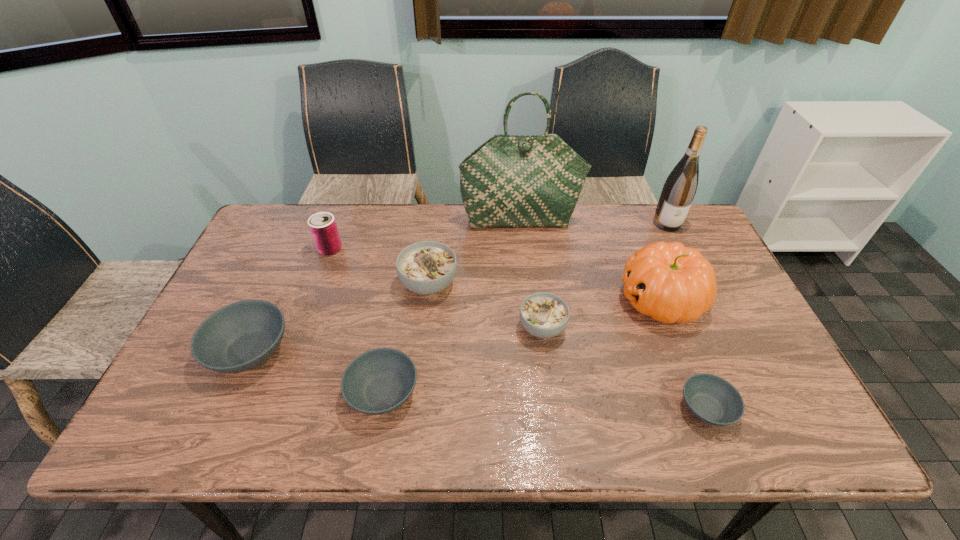
At what (x,y) coordinates should I click in order to perform the action: click on wine bottle that is at the far edge. Please return your answer as a coordinate pair (x, y). The image size is (960, 540). Looking at the image, I should click on (678, 192).

Identify the location of can that is at the far edge. The height and width of the screenshot is (540, 960). (323, 228).

The width and height of the screenshot is (960, 540). I want to click on object that is at the left edge, so click(x=241, y=336).

Where is `wine bottle positioned at the right edge`? The width and height of the screenshot is (960, 540). wine bottle positioned at the right edge is located at coordinates (678, 192).

Where is `pumpkin at the right edge`? Image resolution: width=960 pixels, height=540 pixels. pumpkin at the right edge is located at coordinates (671, 283).

In order to click on soup bowl situated at the right edge in this screenshot , I will do `click(712, 399)`.

The image size is (960, 540). In order to click on object located at the far right corner in this screenshot , I will do `click(678, 192)`.

Where is `object at the near right corner`? Image resolution: width=960 pixels, height=540 pixels. object at the near right corner is located at coordinates (712, 399).

This screenshot has height=540, width=960. I want to click on free space at the far edge of the desktop, so click(302, 249).

You are a GUI agent. You are given a task and a screenshot of the screen. Output one action in this format:
    pyautogui.click(x=<x>, y=<y>)
    Task: Click on the vacant space at the near edge of the desktop
    
    Given the screenshot: What is the action you would take?
    click(x=253, y=444)